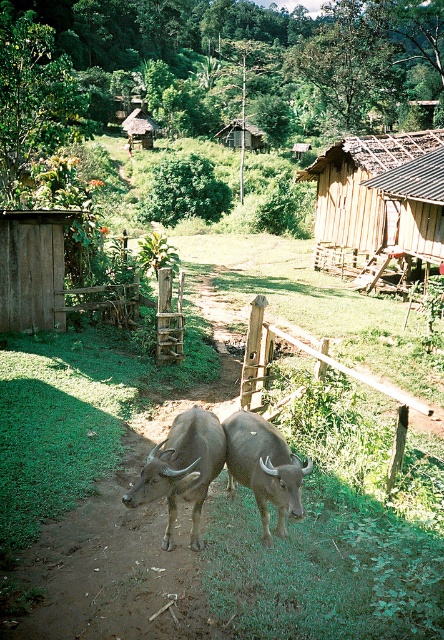
You are a traveler standing at the center of the dirt path in the rural scene. You want to reach the wooden hut at upper right. Which direction should you head towards from your current position?

The wooden hut at upper right is located at coordinates point (x=361, y=188), so you should head towards the upper right direction from your current position on the dirt path.

You are a farmer who wants to build a fence between the brown rough textured buffalo at center and the wooden thatched hut at upper center. Based on their sizes, which one requires more space for the fence?

The wooden thatched hut at upper center requires more space for the fence because its width is greater than the brown rough textured buffalo at center.